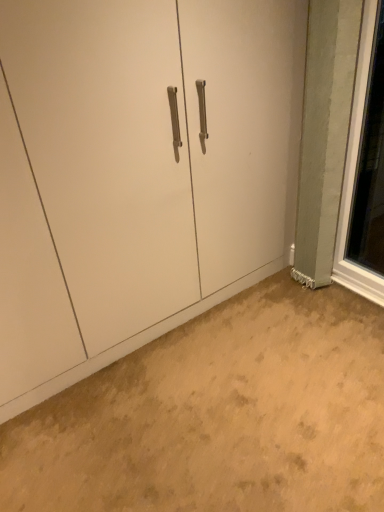
Locate an element on the screen. The width and height of the screenshot is (384, 512). beige carpet at lower center is located at coordinates (219, 415).

The height and width of the screenshot is (512, 384). What do you see at coordinates (154, 159) in the screenshot?
I see `matte white cabinet at center` at bounding box center [154, 159].

What do you see at coordinates (355, 172) in the screenshot? The height and width of the screenshot is (512, 384). I see `clear glass window at right` at bounding box center [355, 172].

Locate an element on the screen. The image size is (384, 512). beige carpet at lower center is located at coordinates (219, 415).

Which is in front, point (348, 209) or point (135, 461)?

Positioned in front is point (135, 461).

From a real-world perspective, who is located higher, clear glass window at right or beige carpet at lower center?

clear glass window at right is physically above.

From the image's perspective, between clear glass window at right and beige carpet at lower center, which one is located above?

From the image's view, clear glass window at right is above.

Considering the sizes of objects clear glass window at right and beige carpet at lower center in the image provided, who is taller, clear glass window at right or beige carpet at lower center?

clear glass window at right is taller.

Between matte white cabinet at center and beige carpet at lower center, which one is positioned in front?

beige carpet at lower center is closer to the camera.

Is matte white cabinet at center beside beige carpet at lower center?

No, matte white cabinet at center is not next to beige carpet at lower center.

What's the angular difference between matte white cabinet at center and beige carpet at lower center's facing directions?

They differ by 180 degrees in their facing directions.

From a real-world perspective, between matte white cabinet at center and beige carpet at lower center, who is vertically higher?

matte white cabinet at center.

Which is behind, beige carpet at lower center or matte white cabinet at center?

matte white cabinet at center is further away from the camera.

Between beige carpet at lower center and matte white cabinet at center, which one has more height?

matte white cabinet at center is taller.

From the image's perspective, does beige carpet at lower center appear lower than matte white cabinet at center?

Yes.

From the image's perspective, which one is positioned lower, beige carpet at lower center or clear glass window at right?

beige carpet at lower center.

Can you confirm if beige carpet at lower center is bigger than clear glass window at right?

Yes.

Identify the location of concrete that appears in front of the clear glass window at right. (219, 415).

Is beige carpet at lower center not inside clear glass window at right?

Yes, beige carpet at lower center is located beyond the bounds of clear glass window at right.

Consider the image. Could clear glass window at right be considered to be inside matte white cabinet at center?

Actually, clear glass window at right is outside matte white cabinet at center.

From the image's perspective, which object appears higher, matte white cabinet at center or clear glass window at right?

From the image's view, clear glass window at right is above.

Is matte white cabinet at center in front of or behind clear glass window at right in the image?

matte white cabinet at center is in front of clear glass window at right.

Considering the sizes of objects matte white cabinet at center and clear glass window at right in the image provided, who is taller, matte white cabinet at center or clear glass window at right?

matte white cabinet at center is taller.

Locate an element on the screen. door in front of the clear glass window at right is located at coordinates (154, 159).

From a real-world perspective, which is physically above, clear glass window at right or matte white cabinet at center?

matte white cabinet at center, from a real-world perspective.

Based on the photo, considering the relative sizes of clear glass window at right and matte white cabinet at center in the image provided, is clear glass window at right bigger than matte white cabinet at center?

No, clear glass window at right is not bigger than matte white cabinet at center.

You are a GUI agent. You are given a task and a screenshot of the screen. Output one action in this format:
    pyautogui.click(x=<x>, y=<y>)
    Task: Click on the concrete below the clear glass window at right (from a real-world perspective)
    
    Given the screenshot: What is the action you would take?
    pyautogui.click(x=219, y=415)

This screenshot has width=384, height=512. In the image, there is a beige carpet at lower center. Find the location of `door above it (from the image's perspective)`. door above it (from the image's perspective) is located at coordinates (154, 159).

Looking at the image, which one is located further to clear glass window at right, beige carpet at lower center or matte white cabinet at center?

The object further to clear glass window at right is beige carpet at lower center.

Which object lies further to the anchor point beige carpet at lower center, clear glass window at right or matte white cabinet at center?

clear glass window at right is further to beige carpet at lower center.

Looking at the image, which one is located further to matte white cabinet at center, clear glass window at right or beige carpet at lower center?

clear glass window at right lies further to matte white cabinet at center than the other object.

Which object lies further to the anchor point matte white cabinet at center, beige carpet at lower center or clear glass window at right?

clear glass window at right is further to matte white cabinet at center.

Based on the photo, looking at the image, which one is located closer to clear glass window at right, matte white cabinet at center or beige carpet at lower center?

The object closer to clear glass window at right is matte white cabinet at center.

Estimate the real-world distances between objects in this image. Which object is further from beige carpet at lower center, matte white cabinet at center or clear glass window at right?

clear glass window at right lies further to beige carpet at lower center than the other object.

Where is `concrete between matte white cabinet at center and clear glass window at right in the horizontal direction`? Image resolution: width=384 pixels, height=512 pixels. concrete between matte white cabinet at center and clear glass window at right in the horizontal direction is located at coordinates (219, 415).